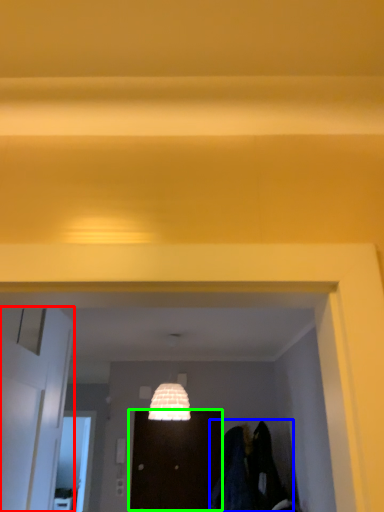
Question: Which object is the closest to the door (highlighted by a red box)? Choose among these: laundry (highlighted by a blue box) or door (highlighted by a green box).

Choices:
 (A) laundry
 (B) door

Answer: (A)